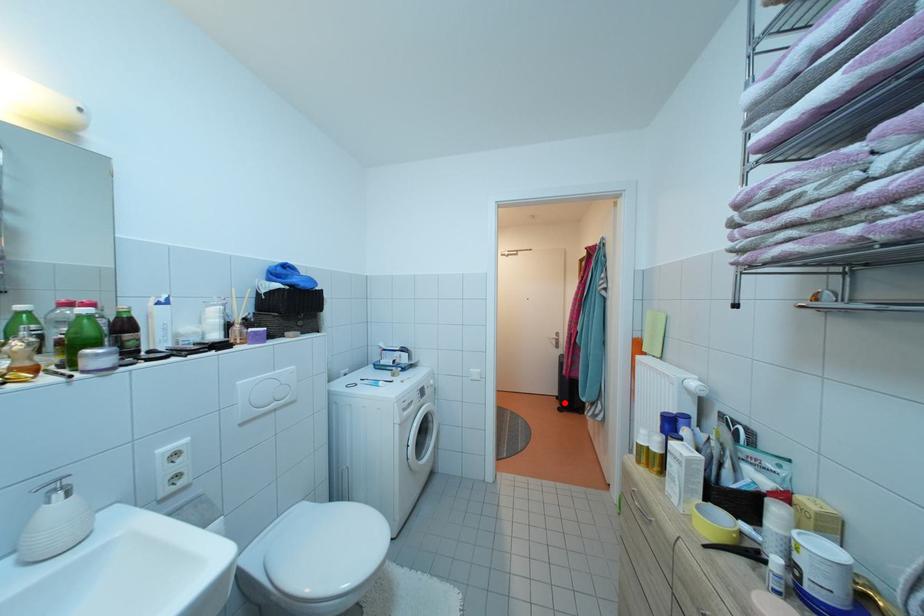
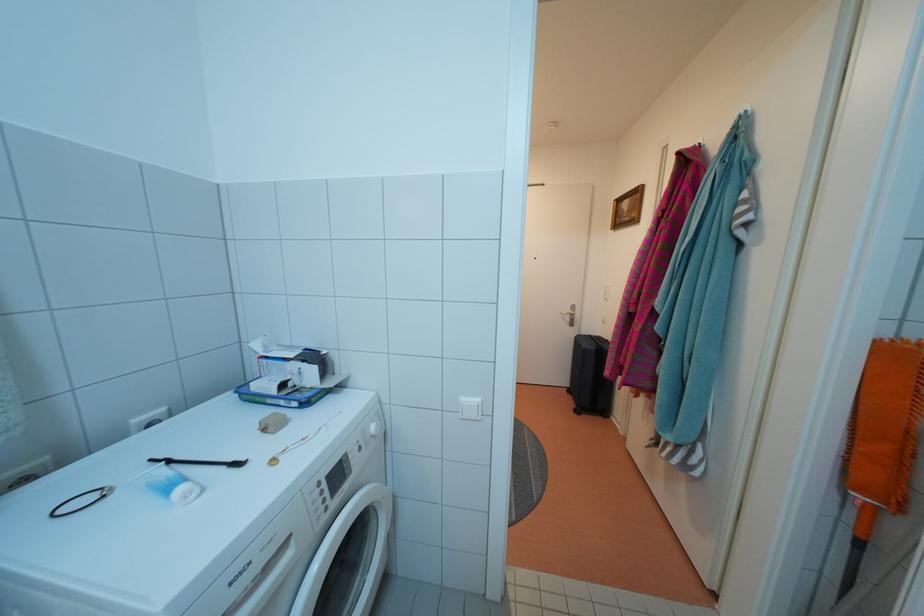
Question: I am providing you with two images of the same scene from different viewpoints. Image1 has a red point marked. In image2, the corresponding 3D location appears at what relative position? Reply with the corresponding letter.

Choices:
 (A) Closer
 (B) Farther

Answer: (B)